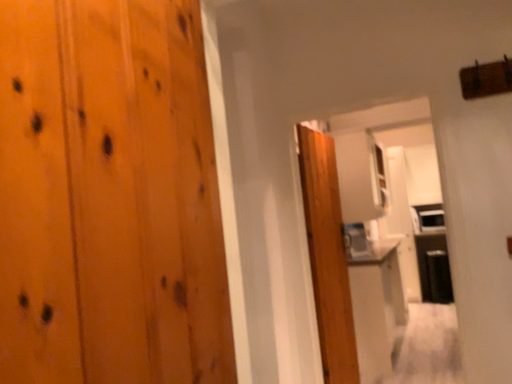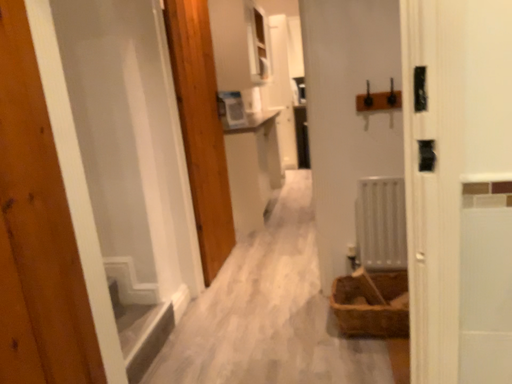
Question: How did the camera likely rotate when shooting the video?

Choices:
 (A) rotated upward
 (B) rotated downward

Answer: (B)